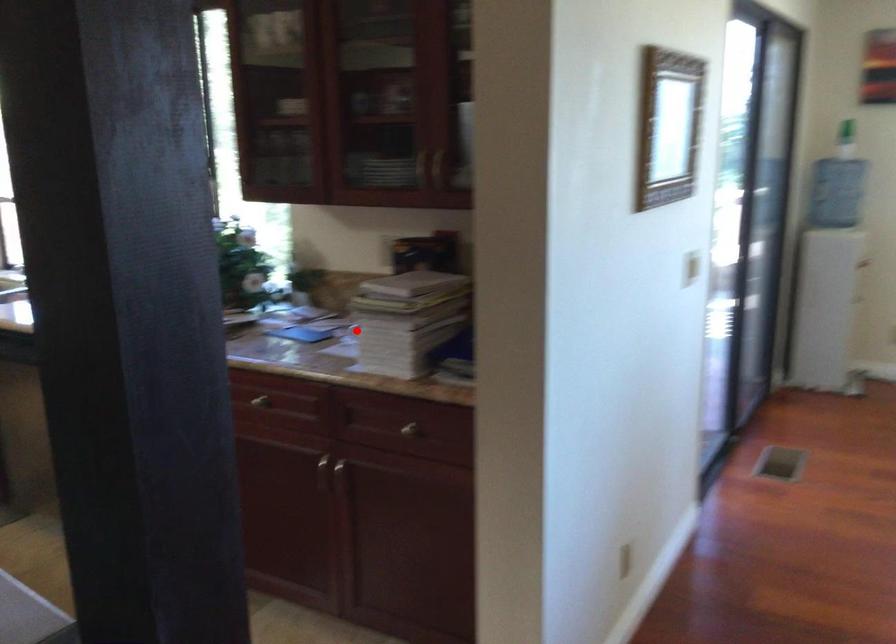
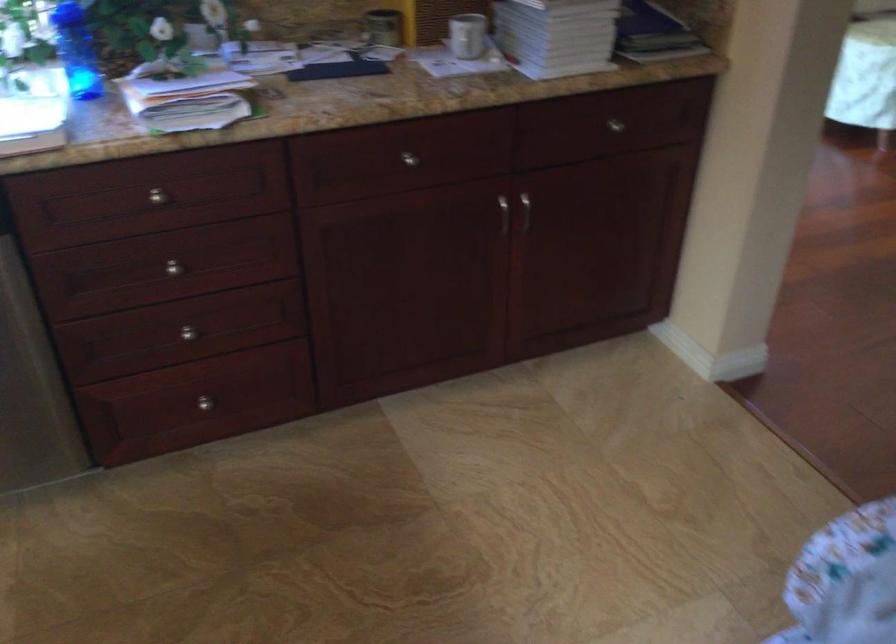
Question: A red point is marked in image1. In image2, is the corresponding 3D point closer to the camera or farther? Reply with the corresponding letter.

Choices:
 (A) The corresponding 3D point is closer.
 (B) The corresponding 3D point is farther.

Answer: (A)